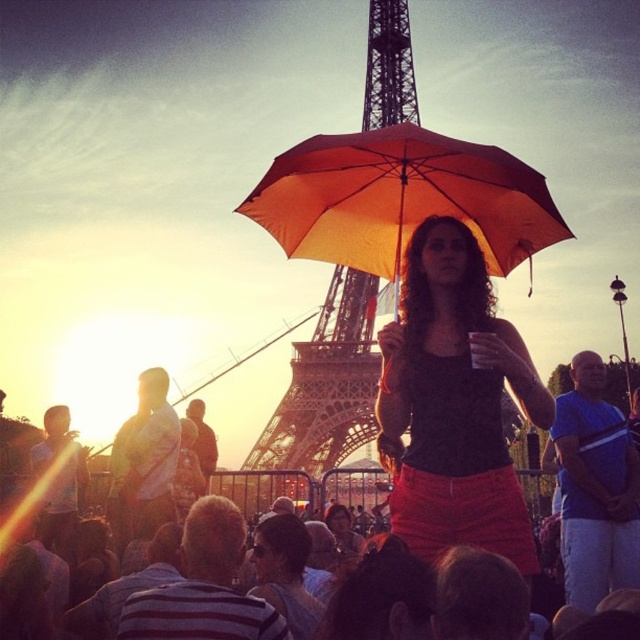
You are a photographer at the event and want to capture a photo where both the matte black tank top at center and the translucent glass beverage at center are clearly visible. Since the sun is causing a lens flare on the left, where should you position yourself relative to the subjects to avoid the glare?

You should position yourself to the right of the subjects to avoid the lens flare on the left side of the image.

You are standing at point (436, 259) and want to reach the Eiffel Tower. The Eiffel Tower is 330 meters tall. If you walk straight towards it, will you be able to see the top of the Eiffel Tower from your current position? Explain your reasoning.

Yes, you will be able to see the top of the Eiffel Tower from your current position at point (436, 259). The distance between you and the Eiffel Tower is 174.48 meters, which is less than the tower height of 330 meters. Since the tower is significantly taller than the distance separating you, its top will remain visible above the horizon.

You are attending an outdoor event near the Eiffel Tower and notice two umbrellas at the center of the scene. Which one is thinner between the orange matte umbrella at center and the matte black umbrella at center?

The orange matte umbrella at center is thinner than the matte black umbrella at center.